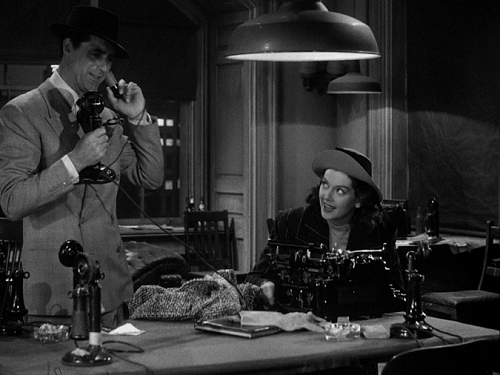
Where is `door`? The width and height of the screenshot is (500, 375). door is located at coordinates (231, 157).